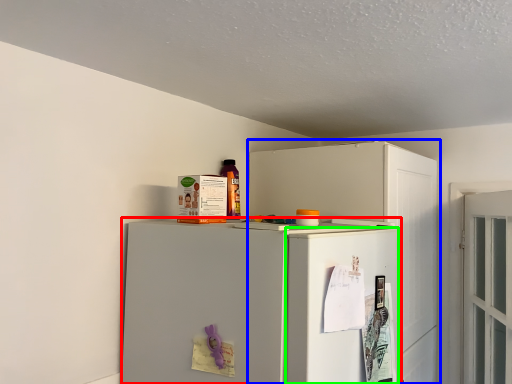
Question: Which object is the closest to the refrigerator (highlighted by a red box)? Choose among these: cabinetry (highlighted by a blue box) or door (highlighted by a green box).

Choices:
 (A) cabinetry
 (B) door

Answer: (B)